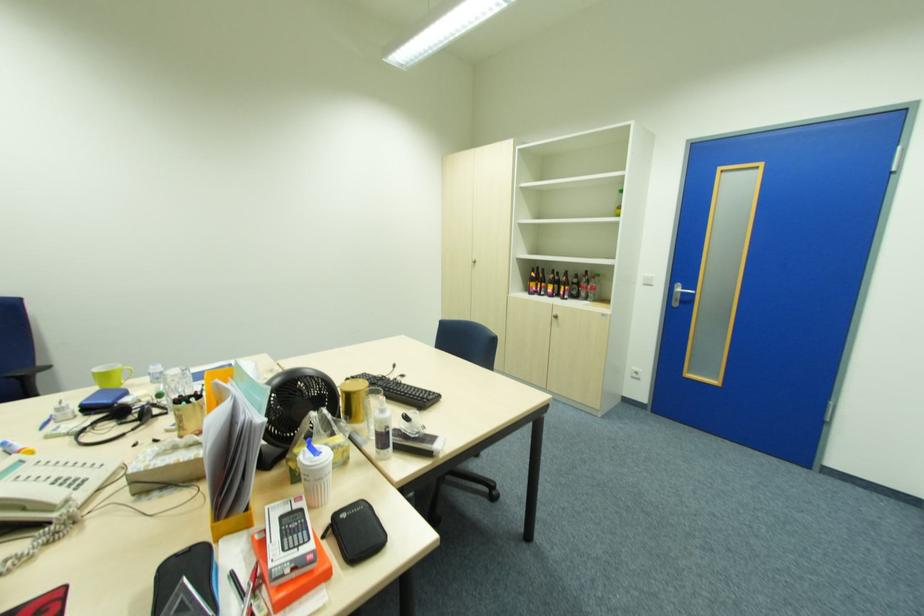
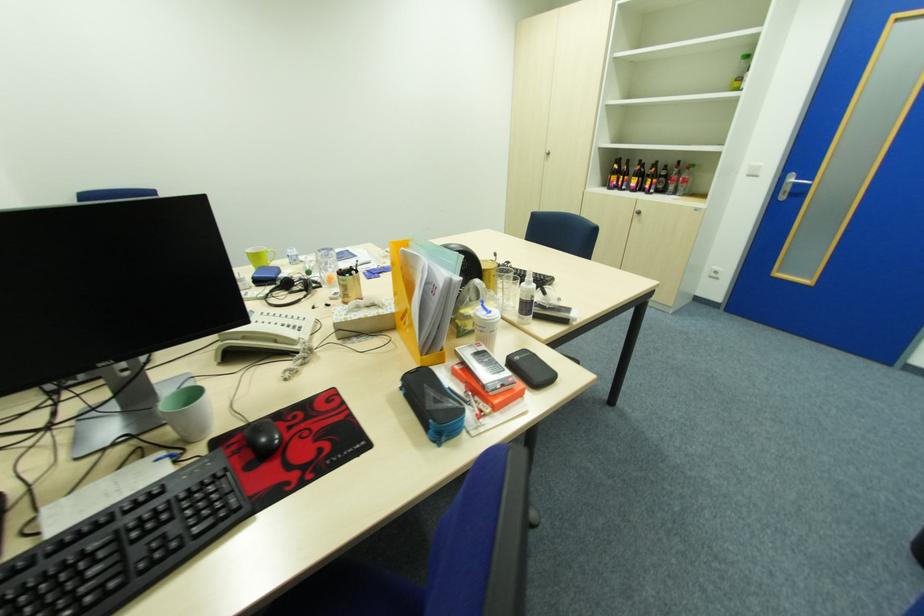
Question: The first image is from the beginning of the video and the second image is from the end. How did the camera likely rotate when shooting the video?

Choices:
 (A) Left
 (B) Right
 (C) Up
 (D) Down

Answer: (D)